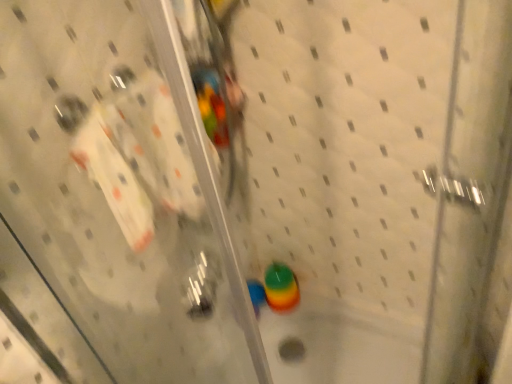
Looking at this image, what is the approximate height of rainbow plastic toy at center?

It is 7.95 inches.

Describe the element at coordinates (281, 287) in the screenshot. This screenshot has height=384, width=512. I see `rainbow plastic toy at center` at that location.

At what (x,y) coordinates should I click in order to perform the action: click on rainbow plastic toy at center. Please return your answer as a coordinate pair (x, y). The height and width of the screenshot is (384, 512). Looking at the image, I should click on click(281, 287).

Find the location of a particular element. The height and width of the screenshot is (384, 512). rainbow plastic toy at center is located at coordinates (281, 287).